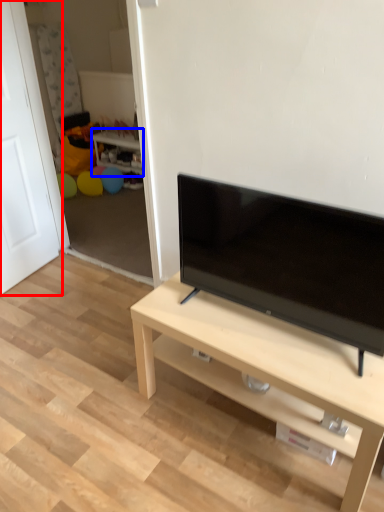
Question: Which object is further to the camera taking this photo, door (highlighted by a red box) or side table (highlighted by a blue box)?

Choices:
 (A) door
 (B) side table

Answer: (B)